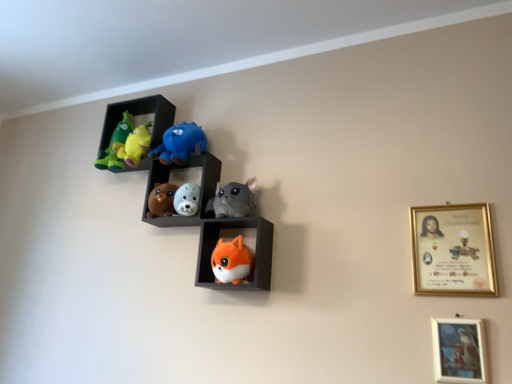
Question: In terms of size, does fluffy white plush seal at center, which is counted as the second toy, starting from the bottom, appear bigger or smaller than velvet plush toys at upper left, the 3th shelf in the bottom-to-top sequence?

Choices:
 (A) big
 (B) small

Answer: (B)

Question: Is fluffy white plush seal at center, which is counted as the second toy, starting from the bottom, to the left or to the right of velvet plush toys at upper left, the 3th shelf in the bottom-to-top sequence, in the image?

Choices:
 (A) left
 (B) right

Answer: (B)

Question: Considering the real-world distances, which object is closest to the gray plush cat at center, arranged as the fourth toy when ordered from the bottom?

Choices:
 (A) fluffy orange fox at lower center, which ranks as the fifth toy in top-to-bottom order
 (B) gold-framed certificate at upper right, the second picture frame from the bottom
 (C) fluffy orange fox at center, arranged as the 3th shelf when viewed from the top
 (D) soft plush toys at center, which is the 3th toy in top-to-bottom order
 (E) fluffy plush toys at center, marked as the 2th shelf in a bottom-to-top arrangement

Answer: (C)

Question: Which is nearer to the fluffy orange fox at center, arranged as the 3th shelf when viewed from the top?

Choices:
 (A) gold-framed painting at lower right, which ranks as the 1th picture frame in bottom-to-top order
 (B) matte blue plush at upper center, arranged as the 1th toy when viewed from the top
 (C) fluffy white plush seal at center, which is counted as the second toy, starting from the bottom
 (D) gold-framed certificate at upper right, which is the first picture frame from top to bottom
 (E) gray plush cat at center, which appears as the 2th toy when viewed from the top

Answer: (E)